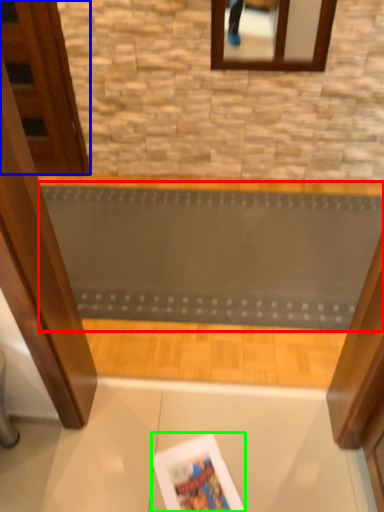
Question: Which is nearer to the ramp (highlighted by a red box)? door (highlighted by a blue box) or magazine (highlighted by a green box).

Choices:
 (A) door
 (B) magazine

Answer: (A)